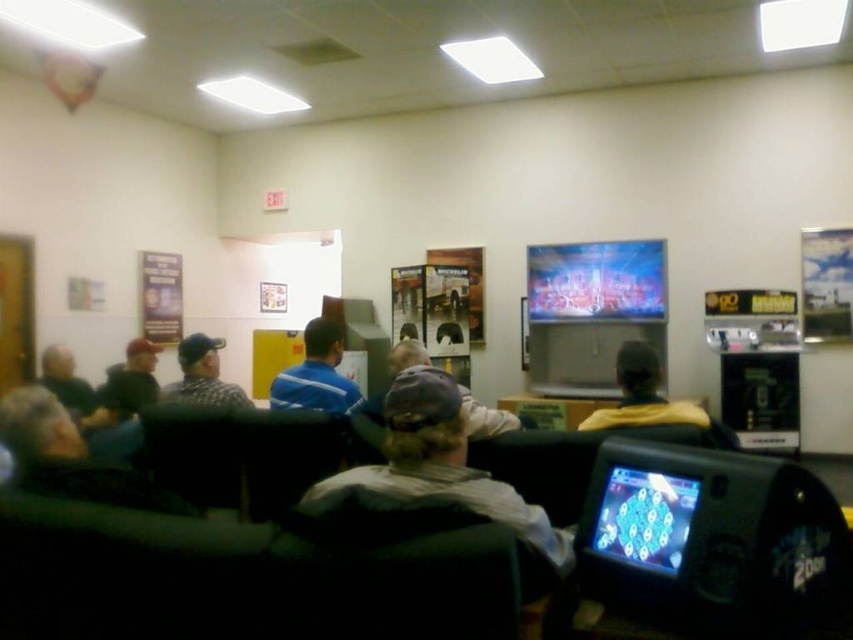
You are standing in the lounge and want to look at the blue jersey at center. Where should you look on the TV screen?

The blue jersey at center is located at the 2D coordinates point [316,372] on the TV screen.

You are standing in the lounge and want to check the location of the shiny plastic screen at lower right. According to the coordinates provided, where exactly is it located?

The shiny plastic screen at lower right is located at point coordinates of (x=643, y=516).